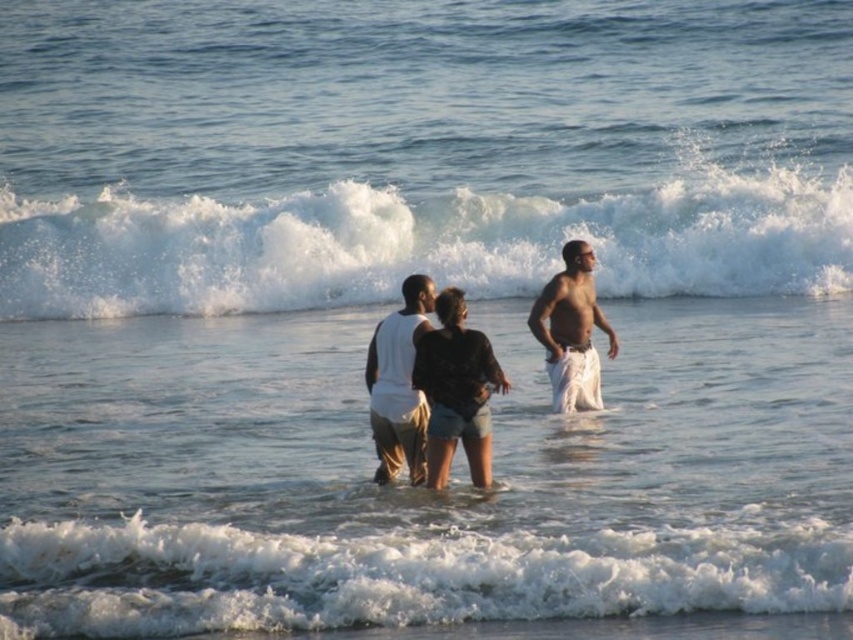
You are a photographer standing at the point marked by the coordinates point (402, 576). You want to capture a photo of the three individuals wading into the ocean. Which direction should you face to ensure they are in the frame?

The point (402, 576) marks the white frothy wave at lower center, so you should face towards the three individuals wading into the ocean who are positioned away from the wave towards the sea. Since the individuals are facing away from the camera towards the sea, turning around from the wave point would position you to face them, ensuring they are in the frame.

You are a photographer aiming to capture a closeup shot of the white cotton tank top at center and the white cotton shorts at right. Based on their positions, which one will appear larger in your photo?

The white cotton tank top at center will appear larger in the photo because it is closer to the viewer than the white cotton shorts at right.

You are a photographer standing at the camera position and want to capture a closeup shot of the white cotton tank top at center. Considering the distance between you and the subject, what camera setting adjustment might you make to ensure the subject is in focus?

The white cotton tank top at center is 25.22 meters away from the camera. To ensure the subject is in focus, you might use a telephoto lens to zoom in and reduce the depth of field, or adjust the aperture to a smaller fstop number for a narrower depth of field, allowing the subject to stand out against the background.